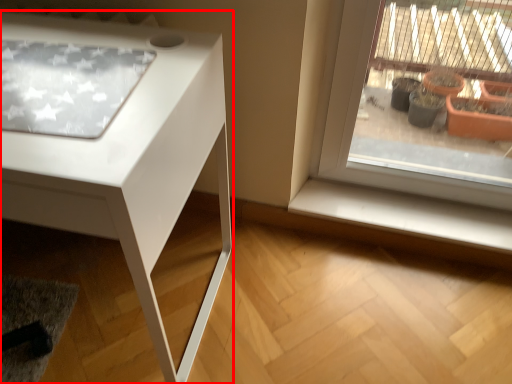
Question: From the image's perspective, what is the correct spatial positioning of table (annotated by the red box) in reference to window sill?

Choices:
 (A) above
 (B) below

Answer: (A)